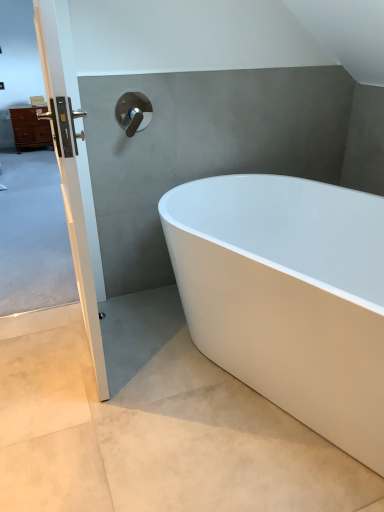
The width and height of the screenshot is (384, 512). What are the coordinates of `vacant area on top of white smooth concrete at lower right (from a real-world perspective)` in the screenshot? It's located at (145, 402).